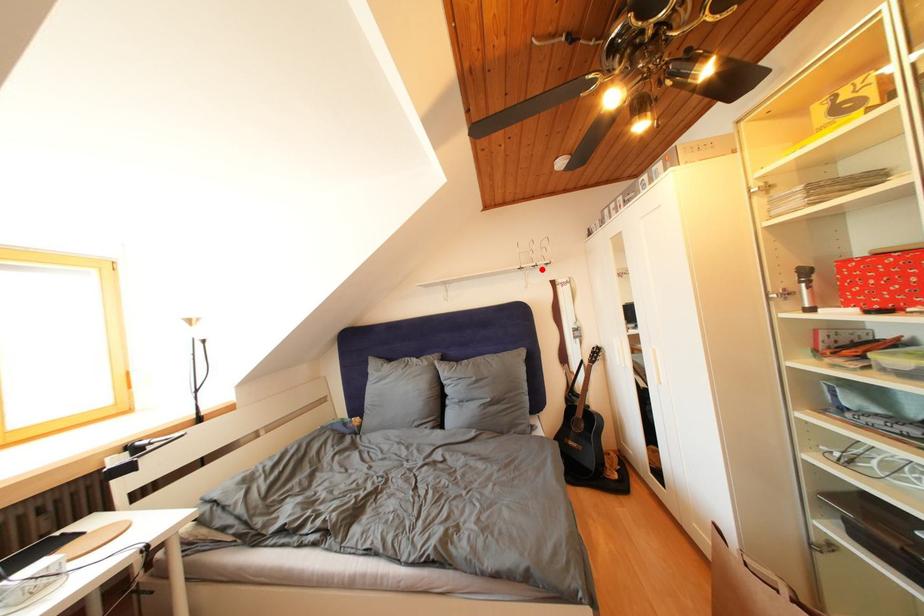
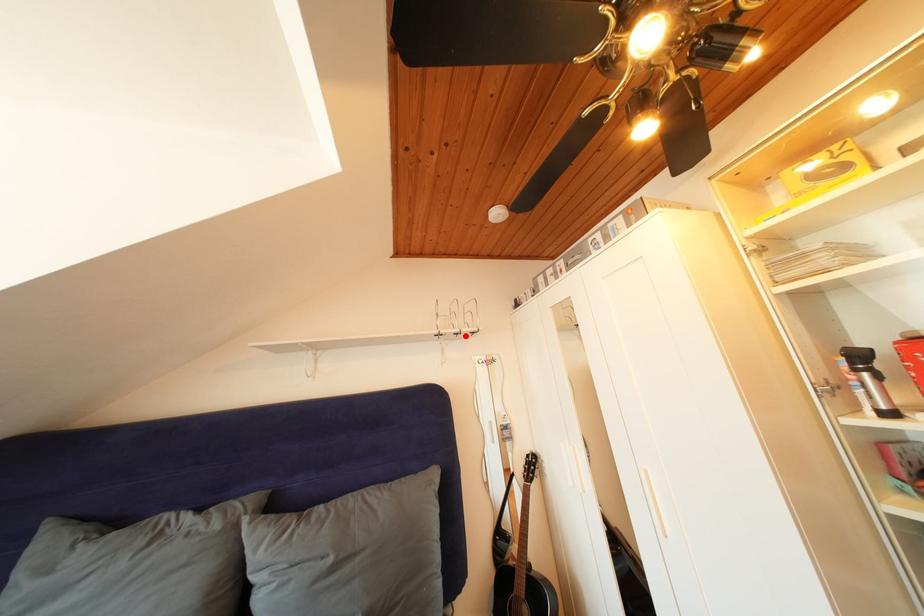
I am providing you with two images of the same scene from different viewpoints. A red point is marked on the first image and another point is marked on the second image. Does the point marked in image1 correspond to the same location as the one in image2?

Yes